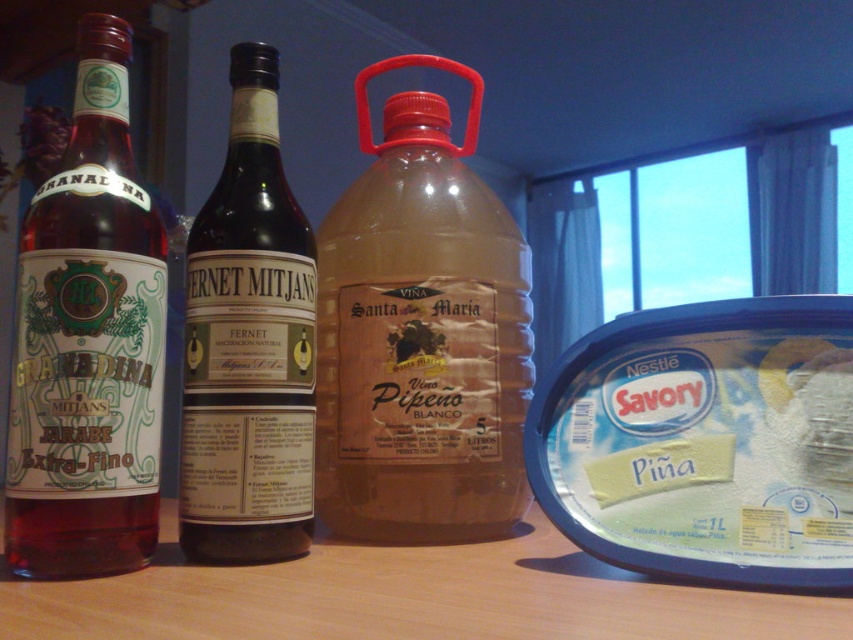
Is matte glass bottle at left shorter than dark glass bottle at center?

No, matte glass bottle at left is not shorter than dark glass bottle at center.

Is point (119, 193) positioned before point (300, 484)?

Yes, it is in front of point (300, 484).

At what (x,y) coordinates should I click in order to perform the action: click on matte glass bottle at left. Please return your answer as a coordinate pair (x, y). Image resolution: width=853 pixels, height=640 pixels. Looking at the image, I should click on (88, 342).

Is translucent plastic bottle at center thinner than matte glass bottle at left?

No.

Does translucent plastic bottle at center lie in front of matte glass bottle at left?

No.

Between point (509, 518) and point (35, 381), which one is positioned behind?

Point (509, 518)

The image size is (853, 640). In order to click on translucent plastic bottle at center in this screenshot , I will do `click(421, 333)`.

Between translucent plastic bottle at center and dark glass bottle at center, which one has more height?

translucent plastic bottle at center

What do you see at coordinates (421, 333) in the screenshot? I see `translucent plastic bottle at center` at bounding box center [421, 333].

Find the location of a particular element. translucent plastic bottle at center is located at coordinates (421, 333).